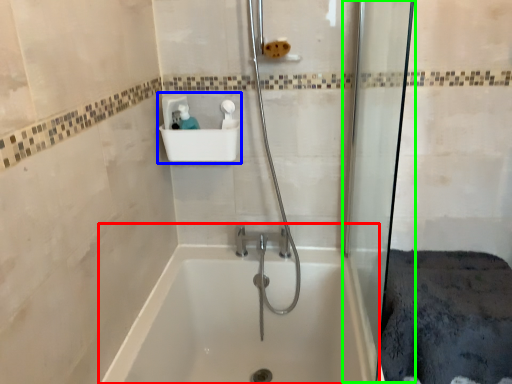
Question: Based on their relative distances, which object is nearer to bathtub (highlighted by a red box)? Choose from sink (highlighted by a blue box) and shower door (highlighted by a green box).

Choices:
 (A) sink
 (B) shower door

Answer: (B)